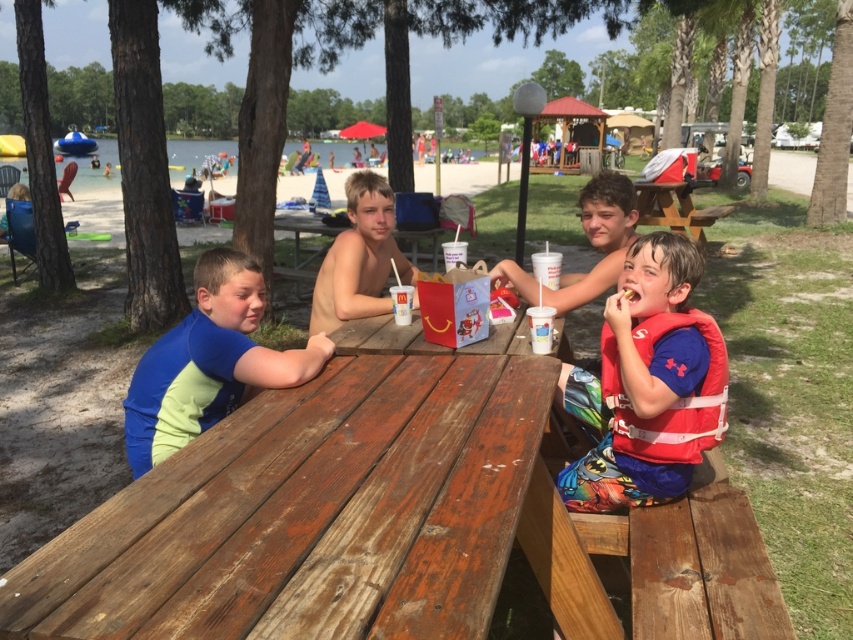
You are standing at the origin point in the park scene. The weathered wood table at center is located at coordinates given in the description. If you want to walk directly to the table, which direction should you head?

The weathered wood table at center is located at coordinates point (x=310, y=515), so you should head towards the right and forward direction to reach it.

You are standing at the picnic table and want to place a snack on the table. If you want to place it closer to you, which point should you choose between point (350,632) and point (241,268)?

Point (350,632) is closer to the viewer than point (241,268), so you should place the snack at point (350,632) to have it closer to you.